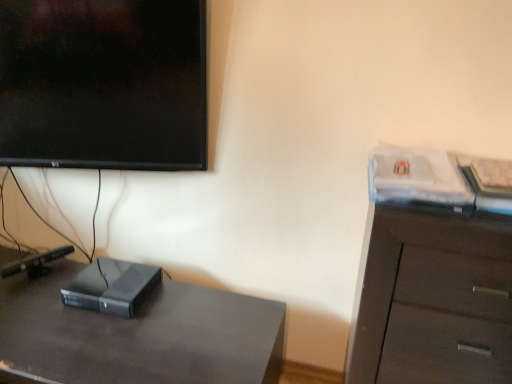
Question: Would you say black matte computer at lower left is inside or outside dark wood cabinet at right?

Choices:
 (A) outside
 (B) inside

Answer: (A)

Question: From the image's perspective, is black matte computer at lower left above or below dark wood cabinet at right?

Choices:
 (A) below
 (B) above

Answer: (B)

Question: Which object is positioned farthest from the black matte desk at lower left?

Choices:
 (A) dark wood cabinet at right
 (B) black matte computer at lower left

Answer: (A)

Question: Estimate the real-world distances between objects in this image. Which object is closer to the dark wood cabinet at right?

Choices:
 (A) black matte desk at lower left
 (B) black matte computer at lower left

Answer: (A)